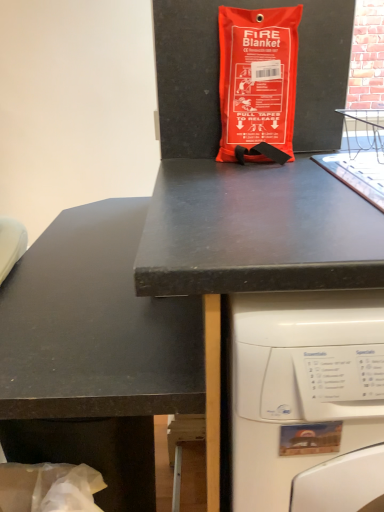
Where is `vacant area on top of black matte desk at upper center (from a real-world perspective)`? vacant area on top of black matte desk at upper center (from a real-world perspective) is located at coordinates (285, 194).